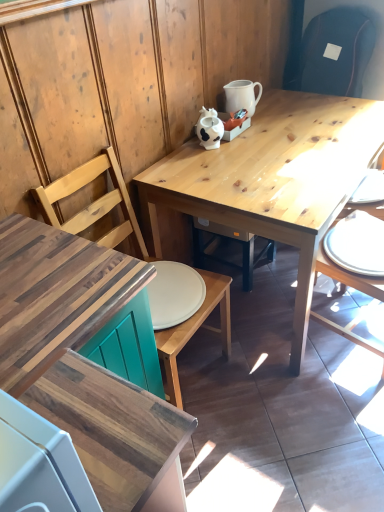
Question: Is natural wood table at center surrounded by white glossy pitcher at upper center?

Choices:
 (A) no
 (B) yes

Answer: (A)

Question: Is the depth of white glossy pitcher at upper center greater than that of natural wood table at center?

Choices:
 (A) yes
 (B) no

Answer: (A)

Question: From the image's perspective, is white glossy pitcher at upper center below natural wood table at center?

Choices:
 (A) yes
 (B) no

Answer: (B)

Question: Does white glossy pitcher at upper center have a lesser width compared to natural wood table at center?

Choices:
 (A) no
 (B) yes

Answer: (B)

Question: Can you confirm if white glossy pitcher at upper center is smaller than natural wood table at center?

Choices:
 (A) no
 (B) yes

Answer: (B)

Question: From the image's perspective, does white glossy pitcher at upper center appear higher than natural wood table at center?

Choices:
 (A) no
 (B) yes

Answer: (B)

Question: Considering the relative sizes of white glossy plate at right and natural wood table at center in the image provided, is white glossy plate at right thinner than natural wood table at center?

Choices:
 (A) yes
 (B) no

Answer: (A)

Question: Can you confirm if white glossy plate at right is positioned to the right of natural wood table at center?

Choices:
 (A) yes
 (B) no

Answer: (A)

Question: Is white glossy plate at right facing towards natural wood table at center?

Choices:
 (A) yes
 (B) no

Answer: (A)

Question: Would you say white glossy plate at right is outside natural wood table at center?

Choices:
 (A) no
 (B) yes

Answer: (B)

Question: Is white glossy plate at right positioned behind natural wood table at center?

Choices:
 (A) yes
 (B) no

Answer: (A)

Question: Can you confirm if white glossy plate at right is taller than natural wood table at center?

Choices:
 (A) no
 (B) yes

Answer: (A)

Question: Considering the relative positions of wooden chair at right, which is the 2th chair in left-to-right order, and white glossy plate at right in the image provided, is wooden chair at right, which is the 2th chair in left-to-right order, to the right of white glossy plate at right from the viewer's perspective?

Choices:
 (A) yes
 (B) no

Answer: (A)